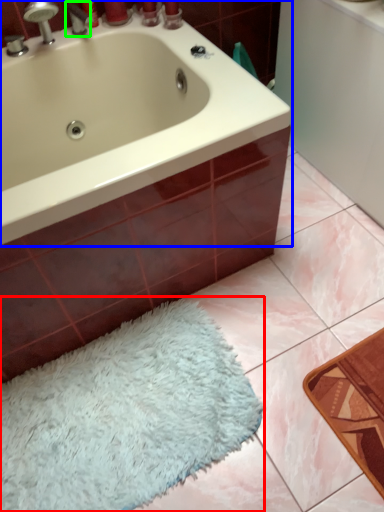
Question: Considering the real-world distances, which object is farthest from bath mat (highlighted by a red box)? bathtub (highlighted by a blue box) or tap (highlighted by a green box)?

Choices:
 (A) bathtub
 (B) tap

Answer: (B)